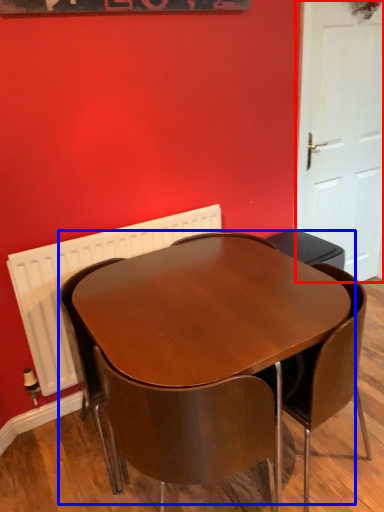
Question: Which object appears closest to the camera in this image, door (highlighted by a red box) or table (highlighted by a blue box)?

Choices:
 (A) door
 (B) table

Answer: (B)